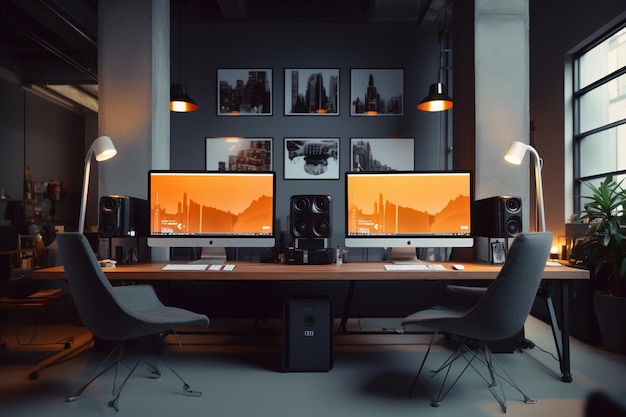
Identify the location of speakers. (314, 216), (509, 217), (114, 217).